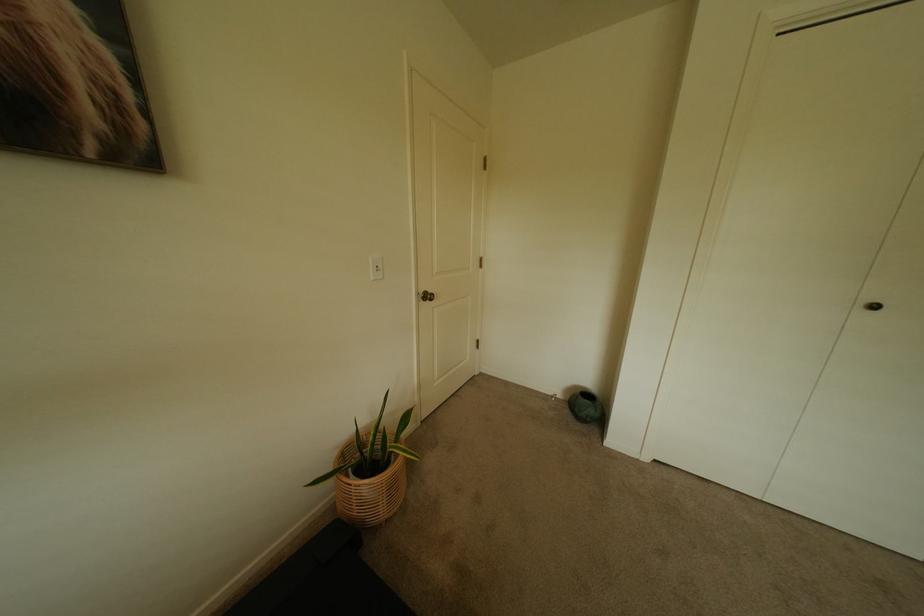
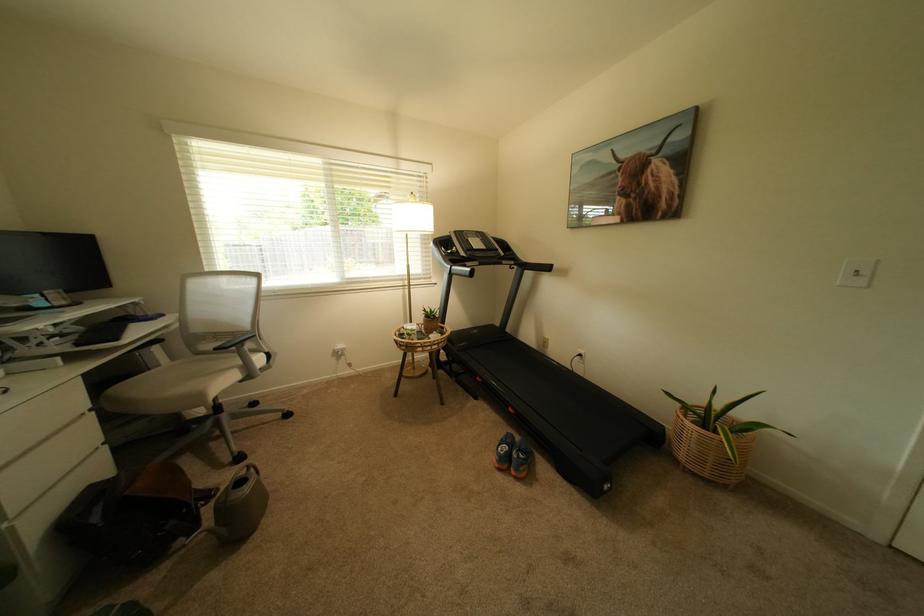
Find the pixel in the second image that matches point (385, 268) in the first image.

(866, 272)